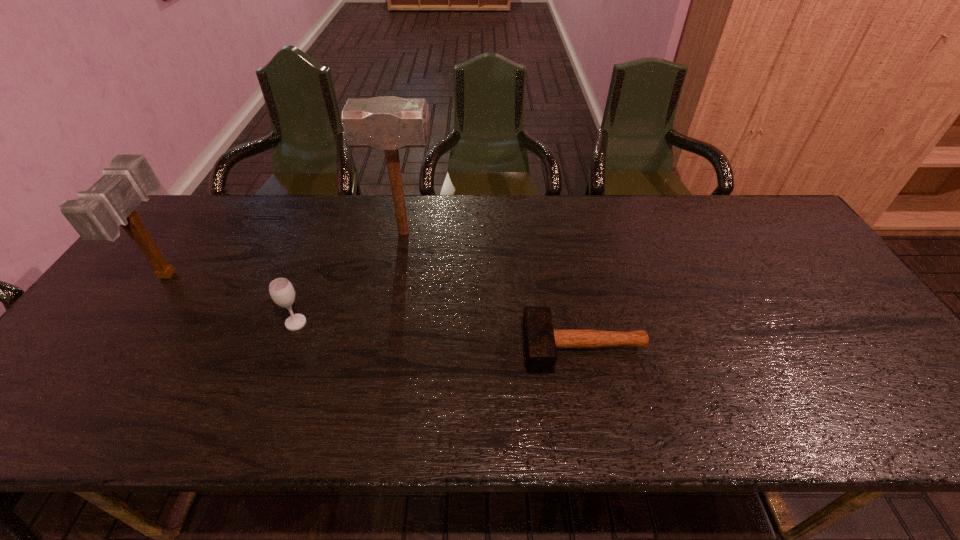
Where is `unoccupied position between the third tallest object and the farthest object`? This screenshot has height=540, width=960. unoccupied position between the third tallest object and the farthest object is located at coordinates (349, 278).

Find the location of a particular element. This screenshot has width=960, height=540. free area in between the nearest mallet and the tallest mallet is located at coordinates (494, 290).

Identify the location of free space between the wineglass and the third object from left to right. (349, 278).

Image resolution: width=960 pixels, height=540 pixels. In order to click on vacant area between the shortest mallet and the leftmost object in this screenshot , I will do coord(376,310).

Where is `free space between the leftmost mallet and the wineglass`? free space between the leftmost mallet and the wineglass is located at coordinates (232, 299).

This screenshot has width=960, height=540. I want to click on free space between the nearest mallet and the second farthest object, so click(x=376, y=310).

Identify the location of vacant area that lies between the second farthest object and the wineglass. This screenshot has height=540, width=960. (232, 299).

Where is `free spot between the shortest mallet and the second mallet from right to left`? free spot between the shortest mallet and the second mallet from right to left is located at coordinates (494, 290).

Locate an element on the screen. This screenshot has height=540, width=960. unoccupied area between the leftmost object and the wineglass is located at coordinates (232, 299).

I want to click on free space between the second object from right to left and the wineglass, so click(x=349, y=278).